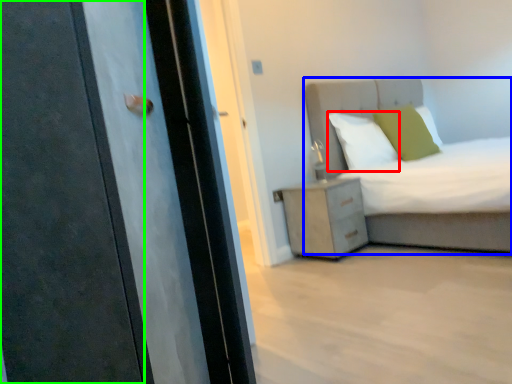
Question: Which is farther away from pillow (highlighted by a red box)? bed (highlighted by a blue box) or door (highlighted by a green box)?

Choices:
 (A) bed
 (B) door

Answer: (B)